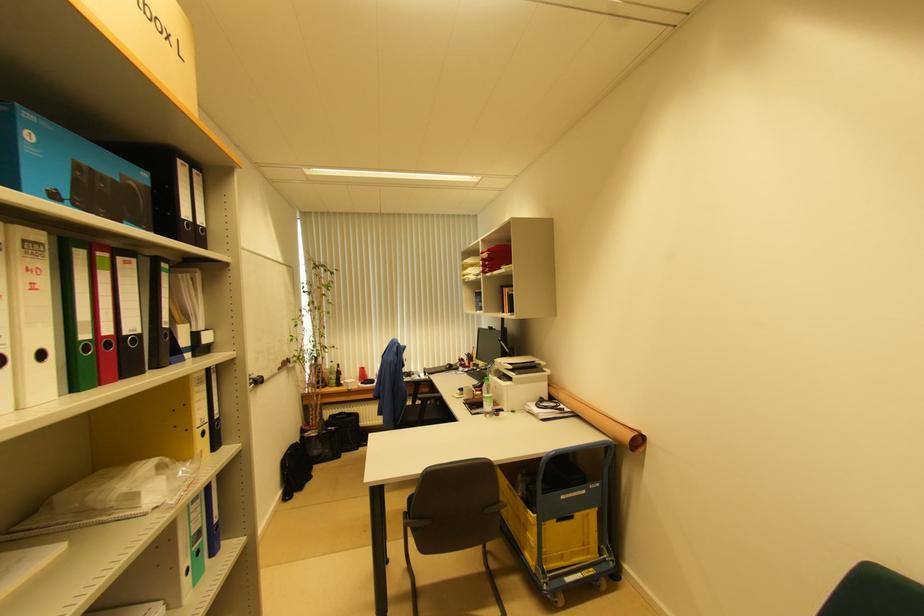
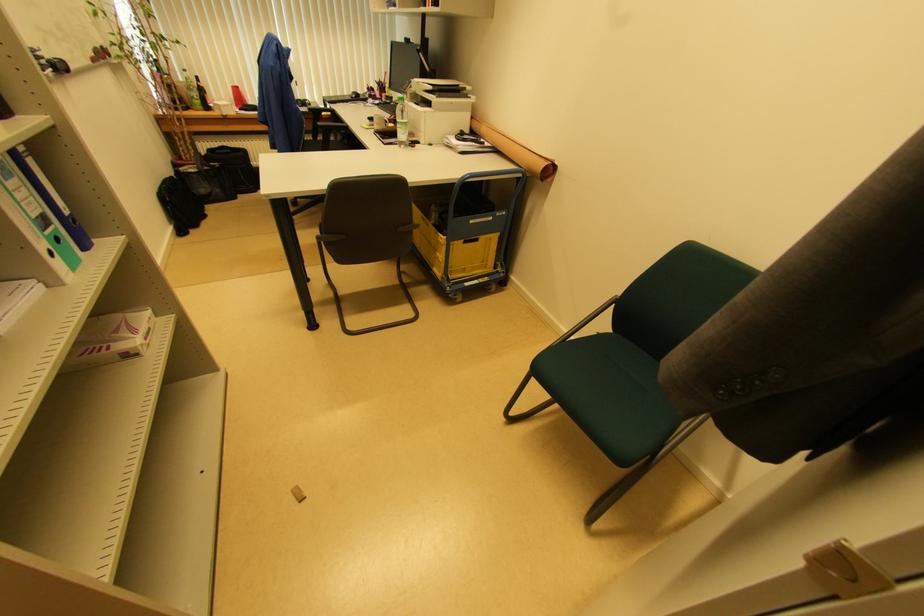
The point at (546, 386) is marked in the first image. Where is the corresponding point in the second image?

(469, 118)